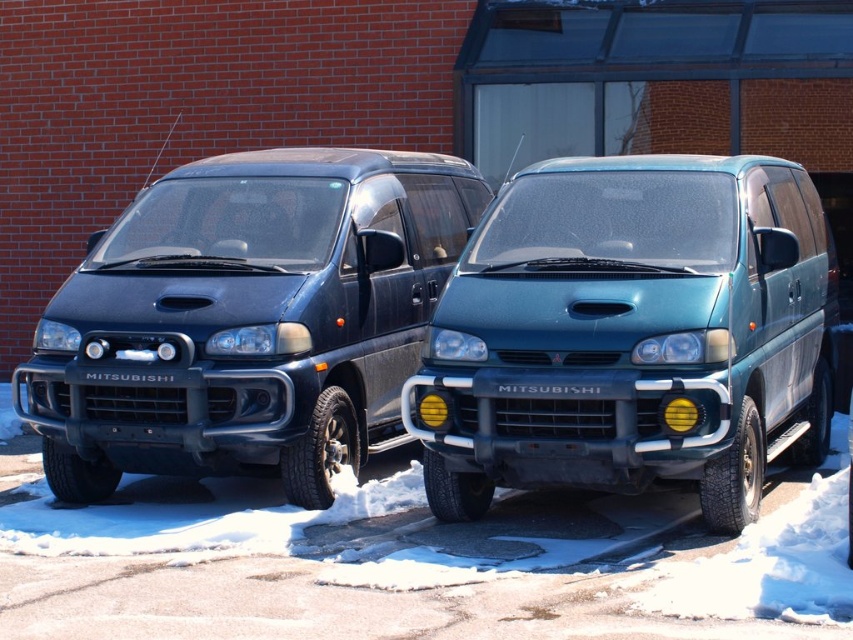
You are a delivery driver who needs to park your van between the teal matte van at center and the matte black van at left. Based on their positions, which van should you position your van closer to in order to fit properly?

The teal matte van at center is located below the matte black van at left. To park between them, you should position your van closer to the matte black van at left since it is above the teal matte van at center, allowing more space in between.

Based on the photo, you are standing at the point marked by coordinates point (x=630, y=333). Looking around, you see a teal matte van at center. Which direction should you face to see the teal matte van at center?

You are already facing the teal matte van at center because the point marked by coordinates point (x=630, y=333) marks the location of the teal matte van at center.